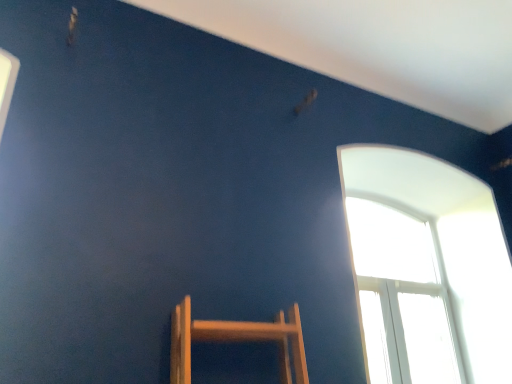
What do you see at coordinates (426, 269) in the screenshot? The image size is (512, 384). I see `transparent glass window at upper right` at bounding box center [426, 269].

The image size is (512, 384). Identify the location of transparent glass window at upper right. (426, 269).

Measure the distance between transparent glass window at upper right and camera.

transparent glass window at upper right and camera are 8.56 feet apart from each other.

The image size is (512, 384). In order to click on transparent glass window at upper right in this screenshot , I will do `click(426, 269)`.